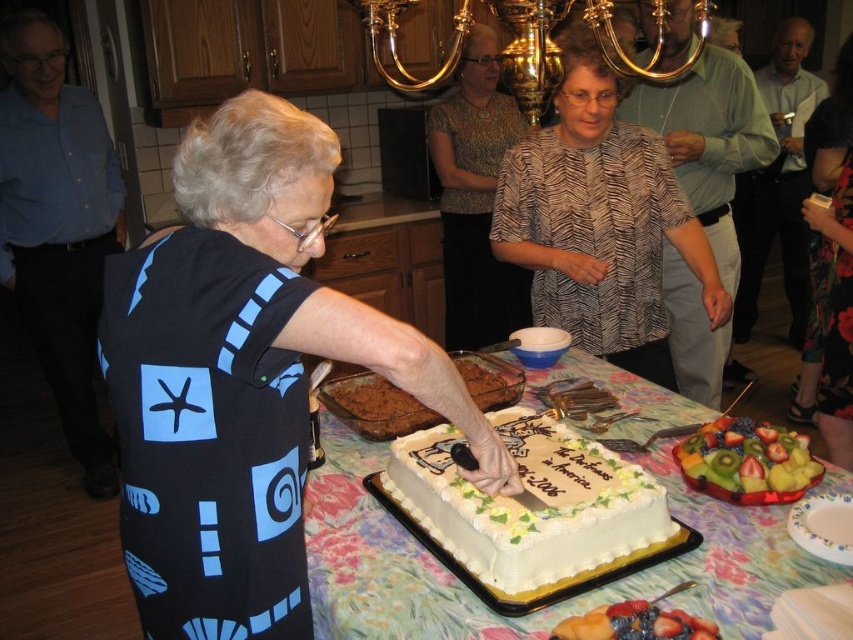
Question: Can you confirm if fruity mix at lower right is positioned to the left of shiny red berries at lower center?

Choices:
 (A) no
 (B) yes

Answer: (A)

Question: Does white frosted cake at center appear under shiny red berries at lower center?

Choices:
 (A) yes
 (B) no

Answer: (B)

Question: Which point is closer to the camera taking this photo?

Choices:
 (A) (578, 49)
 (B) (631, 484)
 (C) (709, 509)

Answer: (B)

Question: Which point is closer to the camera?

Choices:
 (A) (497, 269)
 (B) (672, 614)
 (C) (614, 189)
 (D) (606, 458)

Answer: (B)

Question: Can you confirm if printed fabric blouse at center is positioned to the right of shiny red berries at lower center?

Choices:
 (A) no
 (B) yes

Answer: (B)

Question: Which object is farther from the camera taking this photo?

Choices:
 (A) shiny red berries at lower center
 (B) fruity mix at lower right

Answer: (B)